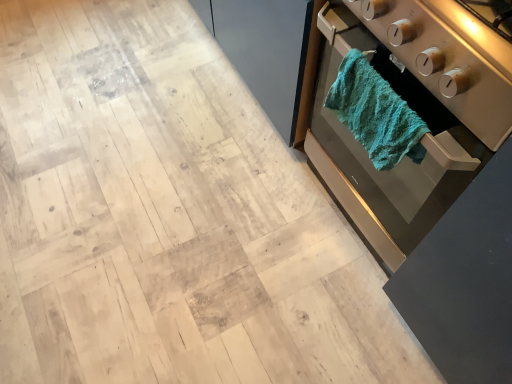
Question: Is teal fabric towel at right to the right of teal textured towel at right from the viewer's perspective?

Choices:
 (A) yes
 (B) no

Answer: (A)

Question: Does teal fabric towel at right have a greater width compared to teal textured towel at right?

Choices:
 (A) no
 (B) yes

Answer: (B)

Question: Can teal textured towel at right be found inside teal fabric towel at right?

Choices:
 (A) no
 (B) yes

Answer: (B)

Question: Does teal fabric towel at right turn towards teal textured towel at right?

Choices:
 (A) yes
 (B) no

Answer: (A)

Question: Is teal fabric towel at right further to camera compared to teal textured towel at right?

Choices:
 (A) yes
 (B) no

Answer: (B)

Question: Is teal fabric towel at right to the left or to the right of teal fabric towel at right in the image?

Choices:
 (A) right
 (B) left

Answer: (B)

Question: Looking at the image, does teal fabric towel at right seem bigger or smaller compared to teal fabric towel at right?

Choices:
 (A) small
 (B) big

Answer: (A)

Question: Does point (414, 46) appear closer or farther from the camera than point (373, 183)?

Choices:
 (A) closer
 (B) farther

Answer: (A)

Question: In terms of height, does teal fabric towel at right look taller or shorter compared to teal fabric towel at right?

Choices:
 (A) short
 (B) tall

Answer: (A)

Question: Is teal textured towel at right bigger or smaller than teal fabric towel at right?

Choices:
 (A) big
 (B) small

Answer: (B)

Question: Is teal textured towel at right taller or shorter than teal fabric towel at right?

Choices:
 (A) tall
 (B) short

Answer: (A)

Question: From a real-world perspective, relative to teal fabric towel at right, is teal textured towel at right vertically above or below?

Choices:
 (A) below
 (B) above

Answer: (A)

Question: From the image's perspective, is teal textured towel at right located above or below teal fabric towel at right?

Choices:
 (A) above
 (B) below

Answer: (B)

Question: In terms of size, does teal textured towel at right appear bigger or smaller than teal fabric towel at right?

Choices:
 (A) small
 (B) big

Answer: (A)

Question: Considering the positions of point (328, 104) and point (321, 110), is point (328, 104) closer or farther from the camera than point (321, 110)?

Choices:
 (A) closer
 (B) farther

Answer: (A)